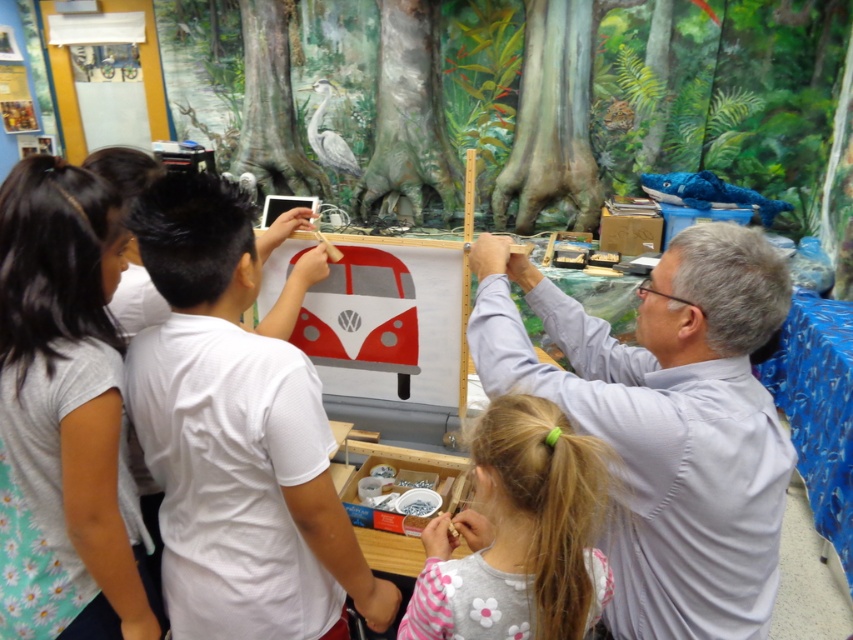
Question: Estimate the real-world distances between objects in this image. Which object is farther from the pastel pink fabric at lower center?

Choices:
 (A) white matte shirt at center
 (B) light gray t-shirt at left

Answer: (B)

Question: Estimate the real-world distances between objects in this image. Which object is closer to the white matte shirt at center?

Choices:
 (A) gray shirt at upper right
 (B) light gray t-shirt at left

Answer: (B)

Question: Can you confirm if gray shirt at upper right is positioned to the left of white matte shirt at center?

Choices:
 (A) yes
 (B) no

Answer: (B)

Question: Does white matte shirt at center appear on the right side of pastel pink fabric at lower center?

Choices:
 (A) yes
 (B) no

Answer: (B)

Question: Based on their relative distances, which object is farther from the white matte shirt at center?

Choices:
 (A) pastel pink fabric at lower center
 (B) light gray t-shirt at left

Answer: (A)

Question: Can you confirm if light gray t-shirt at left is positioned below pastel pink fabric at lower center?

Choices:
 (A) yes
 (B) no

Answer: (B)